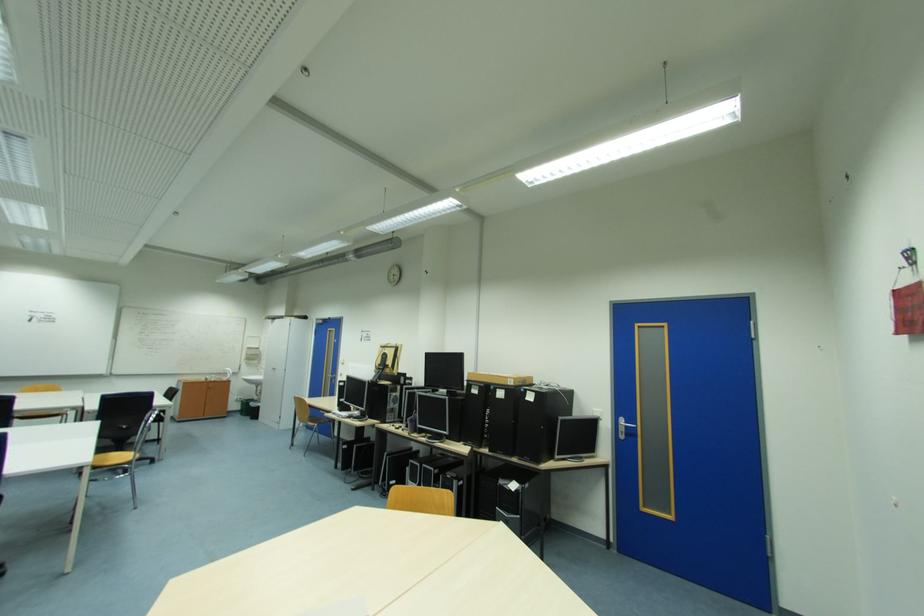
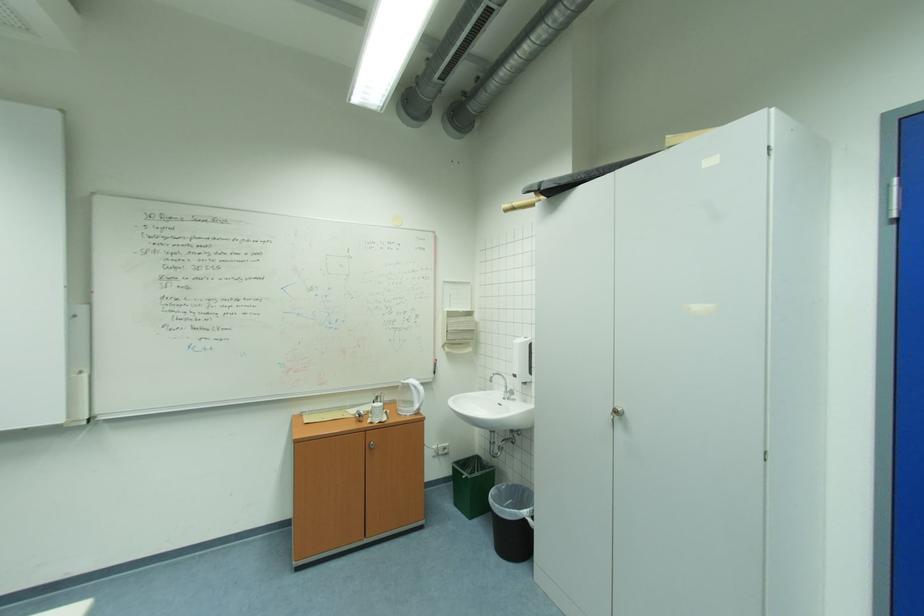
The point at (232, 379) is marked in the first image. Where is the corresponding point in the second image?

(415, 411)